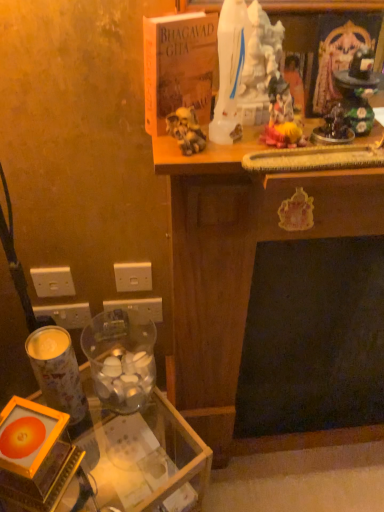
Locate an element on the screen. The image size is (384, 512). metallic cylindrical candle holder at lower left, the second candle holder in the right-to-left sequence is located at coordinates (58, 374).

What do you see at coordinates (178, 66) in the screenshot?
I see `hardcover bhagavad gita at upper center` at bounding box center [178, 66].

Locate an element on the screen. This screenshot has width=384, height=512. hardcover bhagavad gita at upper center is located at coordinates coord(178,66).

The height and width of the screenshot is (512, 384). Describe the element at coordinates (139, 306) in the screenshot. I see `white plastic electric outlet at lower left, arranged as the 3th electric outlet when viewed from the left` at that location.

In order to face transparent glass table at lower left, should I rotate leftwards or rightwards?

A 12.502 degree turn to the left will do.

What is the approximate width of white plastic electric outlet at lower left, the fourth electric outlet when ordered from right to left?

white plastic electric outlet at lower left, the fourth electric outlet when ordered from right to left, is 0.52 inches in width.

Image resolution: width=384 pixels, height=512 pixels. I want to click on white plastic electric outlet at lower left, the 3th electric outlet viewed from the right, so click(x=53, y=282).

Considering the positions of objects white plastic electric outlet at lower left, arranged as the 3th electric outlet when viewed from the left, and white plastic electric outlet at lower left, the 3th electric outlet viewed from the right, in the image provided, who is more to the left, white plastic electric outlet at lower left, arranged as the 3th electric outlet when viewed from the left, or white plastic electric outlet at lower left, the 3th electric outlet viewed from the right,?

white plastic electric outlet at lower left, the 3th electric outlet viewed from the right, is more to the left.

Looking at this image, are white plastic electric outlet at lower left, the second electric outlet when ordered from right to left, and white plastic electric outlet at lower left, the 2th electric outlet from the left, making contact?

There is a gap between white plastic electric outlet at lower left, the second electric outlet when ordered from right to left, and white plastic electric outlet at lower left, the 2th electric outlet from the left.

Looking at this image, is white plastic electric outlet at lower left, arranged as the 3th electric outlet when viewed from the left, bigger or smaller than white plastic electric outlet at lower left, the 3th electric outlet viewed from the right?

white plastic electric outlet at lower left, arranged as the 3th electric outlet when viewed from the left, is bigger than white plastic electric outlet at lower left, the 3th electric outlet viewed from the right.

Is white plastic electric outlet at lower left, arranged as the 3th electric outlet when viewed from the left, facing towards white plastic electric outlet at lower left, the 3th electric outlet viewed from the right?

No, white plastic electric outlet at lower left, arranged as the 3th electric outlet when viewed from the left, is not oriented towards white plastic electric outlet at lower left, the 3th electric outlet viewed from the right.

Does point (93, 432) lie in front of point (146, 313)?

No.

From a real-world perspective, is transparent glass table at lower left below white plastic electric outlet at lower left, arranged as the 3th electric outlet when viewed from the left?

Yes.

Locate an element on the screen. Image resolution: width=384 pixels, height=512 pixels. table below the white plastic electric outlet at lower left, arranged as the 3th electric outlet when viewed from the left (from the image's perspective) is located at coordinates (144, 456).

Is the position of white plastic electric outlet at lower left, arranged as the 3th electric outlet when viewed from the left, less distant than that of metallic cylindrical candle holder at lower left, placed as the first candle holder when sorted from left to right?

No, white plastic electric outlet at lower left, arranged as the 3th electric outlet when viewed from the left, is further to the viewer.

Which of these two, white plastic electric outlet at lower left, the second electric outlet when ordered from right to left, or metallic cylindrical candle holder at lower left, placed as the first candle holder when sorted from left to right, is thinner?

With smaller width is white plastic electric outlet at lower left, the second electric outlet when ordered from right to left.

Is white plastic electric outlet at lower left, arranged as the 3th electric outlet when viewed from the left, not near metallic cylindrical candle holder at lower left, placed as the first candle holder when sorted from left to right?

No, white plastic electric outlet at lower left, arranged as the 3th electric outlet when viewed from the left, is not far away from metallic cylindrical candle holder at lower left, placed as the first candle holder when sorted from left to right.

Between point (149, 304) and point (53, 383), which one is positioned behind?

The point (149, 304) is behind.

Can you confirm if hardcover bhagavad gita at upper center is thinner than wooden desk at center?

Yes, hardcover bhagavad gita at upper center is thinner than wooden desk at center.

From the image's perspective, is hardcover bhagavad gita at upper center located above or below wooden desk at center?

hardcover bhagavad gita at upper center is situated higher than wooden desk at center in the image.

Is point (169, 69) positioned after point (258, 228)?

That is False.

Consider the image. Can you confirm if hardcover bhagavad gita at upper center is positioned to the right of wooden desk at center?

No.

From the image's perspective, which is above, transparent glass table at lower left or wooden desk at center?

wooden desk at center is shown above in the image.

How different are the orientations of transparent glass table at lower left and wooden desk at center in degrees?

There is a 33.5-degree angle between the facing directions of transparent glass table at lower left and wooden desk at center.

You are a GUI agent. You are given a task and a screenshot of the screen. Output one action in this format:
    pyautogui.click(x=<x>, y=<y>)
    Task: Click on the table below the wooden desk at center (from the image's perspective)
    This screenshot has height=512, width=384.
    Given the screenshot: What is the action you would take?
    pyautogui.click(x=144, y=456)

Is transparent glass table at lower left touching wooden desk at center?

transparent glass table at lower left and wooden desk at center are not in contact.

From the image's perspective, is metallic cylindrical candle holder at lower left, placed as the first candle holder when sorted from left to right, over transparent glass candle holder at lower left, the first candle holder from the right?

Actually, metallic cylindrical candle holder at lower left, placed as the first candle holder when sorted from left to right, appears below transparent glass candle holder at lower left, the first candle holder from the right, in the image.

Who is bigger, metallic cylindrical candle holder at lower left, placed as the first candle holder when sorted from left to right, or transparent glass candle holder at lower left, the first candle holder from the right?

Bigger between the two is transparent glass candle holder at lower left, the first candle holder from the right.

Considering the relative positions of metallic cylindrical candle holder at lower left, placed as the first candle holder when sorted from left to right, and transparent glass candle holder at lower left, arranged as the second candle holder when viewed from the left, in the image provided, is metallic cylindrical candle holder at lower left, placed as the first candle holder when sorted from left to right, to the left of transparent glass candle holder at lower left, arranged as the second candle holder when viewed from the left, from the viewer's perspective?

Yes, metallic cylindrical candle holder at lower left, placed as the first candle holder when sorted from left to right, is to the left of transparent glass candle holder at lower left, arranged as the second candle holder when viewed from the left.

Is white plastic electric outlet at lower left, arranged as the 3th electric outlet when viewed from the left, thinner than hardcover bhagavad gita at upper center?

Yes, white plastic electric outlet at lower left, arranged as the 3th electric outlet when viewed from the left, is thinner than hardcover bhagavad gita at upper center.

Between white plastic electric outlet at lower left, arranged as the 3th electric outlet when viewed from the left, and hardcover bhagavad gita at upper center, which one appears on the right side from the viewer's perspective?

hardcover bhagavad gita at upper center is more to the right.

Does point (124, 304) come in front of point (163, 21)?

No, it is behind (163, 21).

Between white plastic electric outlet at lower left, arranged as the 3th electric outlet when viewed from the left, and hardcover bhagavad gita at upper center, which one has more height?

Standing taller between the two is hardcover bhagavad gita at upper center.

This screenshot has width=384, height=512. In order to click on the 3rd electric outlet in front of the white plastic electric outlet at lower left, arranged as the 3th electric outlet when viewed from the left in this screenshot , I will do `click(53, 282)`.

You are a GUI agent. You are given a task and a screenshot of the screen. Output one action in this format:
    pyautogui.click(x=<x>, y=<y>)
    Task: Click on the table that appears below the white plastic electric outlet at lower left, arranged as the 3th electric outlet when viewed from the left (from a real-world perspective)
    The height and width of the screenshot is (512, 384).
    Given the screenshot: What is the action you would take?
    pyautogui.click(x=144, y=456)

Looking at the image, which one is located closer to white plastic electric outlet at lower left, the 2th electric outlet from the left, hardcover bhagavad gita at upper center or white plastic electric outlet at lower left, arranged as the 3th electric outlet when viewed from the left?

white plastic electric outlet at lower left, arranged as the 3th electric outlet when viewed from the left, is positioned closer to the anchor white plastic electric outlet at lower left, the 2th electric outlet from the left.

Considering their positions, is transparent glass table at lower left positioned closer to metallic cylindrical candle holder at lower left, the second candle holder in the right-to-left sequence, than transparent glass candle holder at lower left, the first candle holder from the right?

transparent glass candle holder at lower left, the first candle holder from the right.

Looking at the image, which one is located closer to wooden desk at center, white plastic electric outlet at lower left, the 2th electric outlet from the left, or transparent glass table at lower left?

transparent glass table at lower left is positioned closer to the anchor wooden desk at center.

Estimate the real-world distances between objects in this image. Which object is closer to white plastic electric outlet at lower left, arranged as the 3th electric outlet when viewed from the left, wooden desk at center or white plastic electric outlet at lower left, which appears as the first electric outlet when viewed from the right?

white plastic electric outlet at lower left, which appears as the first electric outlet when viewed from the right, is closer to white plastic electric outlet at lower left, arranged as the 3th electric outlet when viewed from the left.

Considering their positions, is white plastic electric outlet at lower left, the second electric outlet when ordered from right to left, positioned closer to metallic cylindrical candle holder at lower left, the second candle holder in the right-to-left sequence, than wooden desk at center?

The object closer to metallic cylindrical candle holder at lower left, the second candle holder in the right-to-left sequence, is white plastic electric outlet at lower left, the second electric outlet when ordered from right to left.

Estimate the real-world distances between objects in this image. Which object is further from transparent glass table at lower left, metallic cylindrical candle holder at lower left, placed as the first candle holder when sorted from left to right, or wooden desk at center?

wooden desk at center is further to transparent glass table at lower left.

Estimate the real-world distances between objects in this image. Which object is further from white plastic electric outlet at lower left, which appears as the first electric outlet when viewed from the right, hardcover bhagavad gita at upper center or white plastic electric outlet at lower left, the 3th electric outlet viewed from the right?

Based on the image, hardcover bhagavad gita at upper center appears to be further to white plastic electric outlet at lower left, which appears as the first electric outlet when viewed from the right.

Estimate the real-world distances between objects in this image. Which object is closer to white plastic electric outlet at lower left, the 2th electric outlet from the left, white plastic electric outlet at lower left, the fourth electric outlet when ordered from right to left, or transparent glass candle holder at lower left, arranged as the second candle holder when viewed from the left?

white plastic electric outlet at lower left, the fourth electric outlet when ordered from right to left, lies closer to white plastic electric outlet at lower left, the 2th electric outlet from the left, than the other object.

You are a GUI agent. You are given a task and a screenshot of the screen. Output one action in this format:
    pyautogui.click(x=<x>, y=<y>)
    Task: Click on the candle holder between transparent glass candle holder at lower left, arranged as the second candle holder when viewed from the left, and transparent glass table at lower left vertically
    
    Given the screenshot: What is the action you would take?
    pyautogui.click(x=58, y=374)

Locate an element on the screen. electric outlet between white plastic electric outlet at lower left, the fourth electric outlet when ordered from right to left, and white plastic electric outlet at lower left, arranged as the 3th electric outlet when viewed from the left is located at coordinates (53, 282).

Locate an element on the screen. This screenshot has width=384, height=512. candle holder between metallic cylindrical candle holder at lower left, placed as the first candle holder when sorted from left to right, and white plastic electric outlet at lower left, the fourth electric outlet when ordered from right to left, in the front-back direction is located at coordinates (121, 358).

The height and width of the screenshot is (512, 384). I want to click on desk that lies between hardcover bhagavad gita at upper center and metallic cylindrical candle holder at lower left, placed as the first candle holder when sorted from left to right, from top to bottom, so click(x=239, y=261).